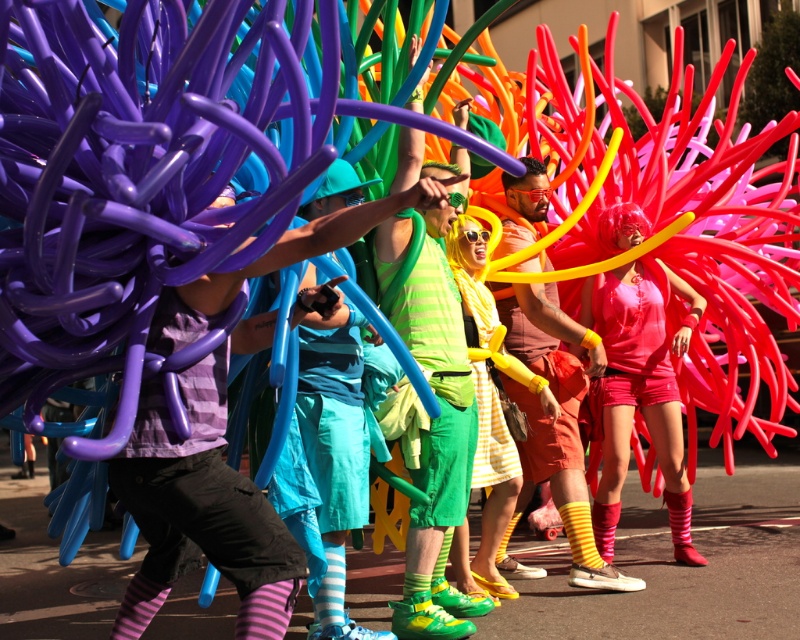
Question: From the image, what is the correct spatial relationship of matte purple balloon at center in relation to matte pink tank top at center?

Choices:
 (A) below
 (B) above

Answer: (B)

Question: From the image, what is the correct spatial relationship of matte purple balloon at center in relation to matte pink tank top at center?

Choices:
 (A) right
 (B) left

Answer: (B)

Question: Which object is farther from the camera taking this photo?

Choices:
 (A) matte purple balloon at center
 (B) matte pink tank top at center

Answer: (B)

Question: Is matte purple balloon at center wider than matte pink tank top at center?

Choices:
 (A) yes
 (B) no

Answer: (A)